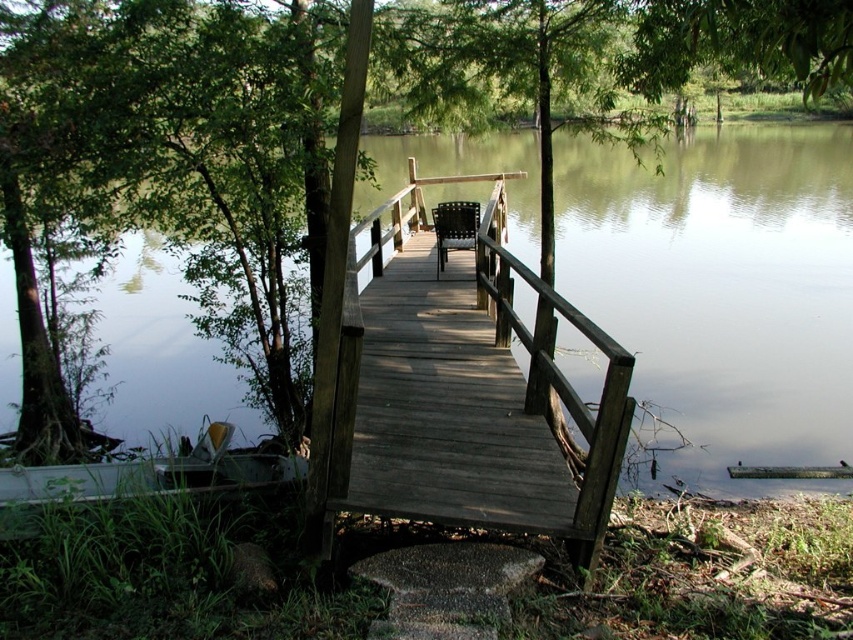
Who is more distant from viewer, (404,500) or (440,256)?

The point (440,256) is behind.

Describe the element at coordinates (463, 390) in the screenshot. I see `dark wood bridge at center` at that location.

Which is in front, point (517, 173) or point (444, 256)?

Positioned in front is point (444, 256).

At what (x,y) coordinates should I click in order to perform the action: click on dark wood bridge at center. Please return your answer as a coordinate pair (x, y). The image size is (853, 640). Looking at the image, I should click on (463, 390).